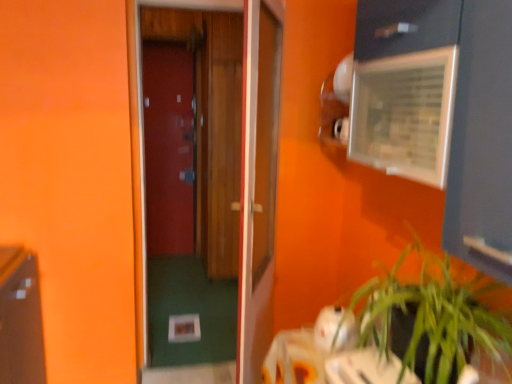
Question: Is clear plastic medicine cabinet at upper right positioned with its back to green leafy plant at lower right?

Choices:
 (A) yes
 (B) no

Answer: (B)

Question: Considering the relative sizes of clear plastic medicine cabinet at upper right and green leafy plant at lower right in the image provided, is clear plastic medicine cabinet at upper right wider than green leafy plant at lower right?

Choices:
 (A) no
 (B) yes

Answer: (A)

Question: Is clear plastic medicine cabinet at upper right thinner than green leafy plant at lower right?

Choices:
 (A) no
 (B) yes

Answer: (B)

Question: Is green leafy plant at lower right completely or partially inside clear plastic medicine cabinet at upper right?

Choices:
 (A) no
 (B) yes

Answer: (A)

Question: Is clear plastic medicine cabinet at upper right aimed at green leafy plant at lower right?

Choices:
 (A) no
 (B) yes

Answer: (A)

Question: Looking at the image, does clear plastic medicine cabinet at upper right seem bigger or smaller compared to wooden door at center, the second door viewed from the back?

Choices:
 (A) big
 (B) small

Answer: (B)

Question: From a real-world perspective, is clear plastic medicine cabinet at upper right positioned above or below wooden door at center, which is counted as the second door, starting from the left?

Choices:
 (A) above
 (B) below

Answer: (A)

Question: Looking at their shapes, would you say clear plastic medicine cabinet at upper right is wider or thinner than wooden door at center, which is the second door in right-to-left order?

Choices:
 (A) wide
 (B) thin

Answer: (A)

Question: Does point (378, 127) appear closer or farther from the camera than point (253, 367)?

Choices:
 (A) farther
 (B) closer

Answer: (B)

Question: Which is correct: green leafy plant at lower right is inside wooden door at center, which is counted as the 1th door, starting from the right, or outside of it?

Choices:
 (A) inside
 (B) outside

Answer: (B)

Question: Looking at their shapes, would you say green leafy plant at lower right is wider or thinner than wooden door at center, which appears as the third door when viewed from the left?

Choices:
 (A) wide
 (B) thin

Answer: (A)

Question: In the image, is green leafy plant at lower right on the left side or the right side of wooden door at center, which is the 3th door in back-to-front order?

Choices:
 (A) left
 (B) right

Answer: (B)

Question: Considering the positions of green leafy plant at lower right and wooden door at center, which appears as the third door when viewed from the left, in the image, is green leafy plant at lower right bigger or smaller than wooden door at center, which appears as the third door when viewed from the left,?

Choices:
 (A) big
 (B) small

Answer: (B)

Question: Which is correct: matte wood door at center, the 1th door when ordered from back to front, is inside wooden door at center, which is counted as the second door, starting from the left, or outside of it?

Choices:
 (A) inside
 (B) outside

Answer: (B)

Question: Based on their sizes in the image, would you say matte wood door at center, which is counted as the 3th door, starting from the front, is bigger or smaller than wooden door at center, which is counted as the second door, starting from the left?

Choices:
 (A) big
 (B) small

Answer: (B)